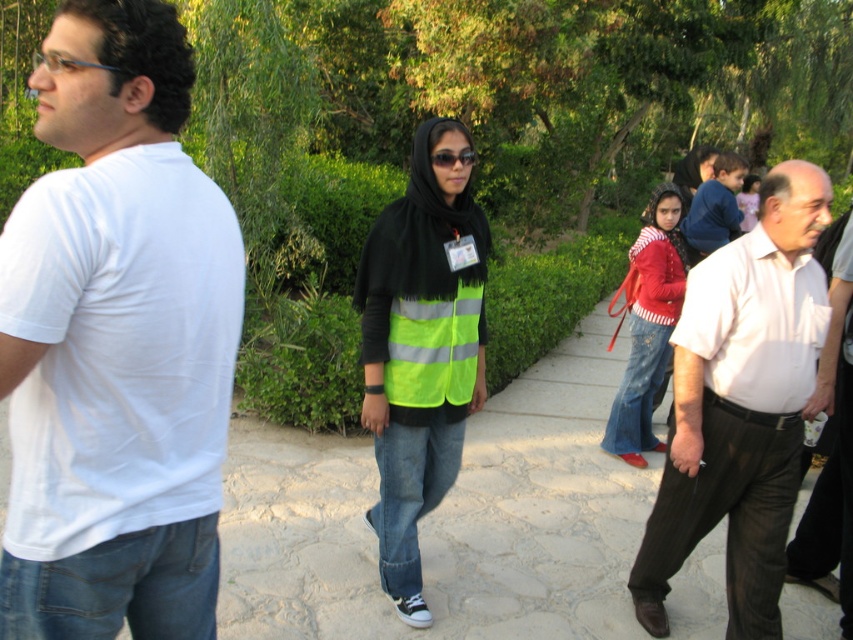
Between point (634, 348) and point (468, 150), which one is positioned in front?

Positioned in front is point (468, 150).

The image size is (853, 640). Find the location of `red striped sweater at center`. red striped sweater at center is located at coordinates (647, 324).

Does point (672, 317) come farther from viewer compared to point (436, 150)?

That is True.

Find the location of a particular element. This screenshot has height=640, width=853. red striped sweater at center is located at coordinates (647, 324).

Does white cotton shirt at center appear on the left side of neon yellow reflective vest at center?

No, white cotton shirt at center is not to the left of neon yellow reflective vest at center.

Find the location of a particular element. The height and width of the screenshot is (640, 853). white cotton shirt at center is located at coordinates (741, 404).

Image resolution: width=853 pixels, height=640 pixels. I want to click on white cotton shirt at center, so click(x=741, y=404).

Who is more distant from viewer, (759, 496) or (666, 241)?

The point (666, 241) is behind.

Is white cotton shirt at center further to the viewer compared to red striped sweater at center?

No, white cotton shirt at center is closer to the viewer.

Image resolution: width=853 pixels, height=640 pixels. What do you see at coordinates (741, 404) in the screenshot?
I see `white cotton shirt at center` at bounding box center [741, 404].

Find the location of a particular element. white cotton shirt at center is located at coordinates (741, 404).